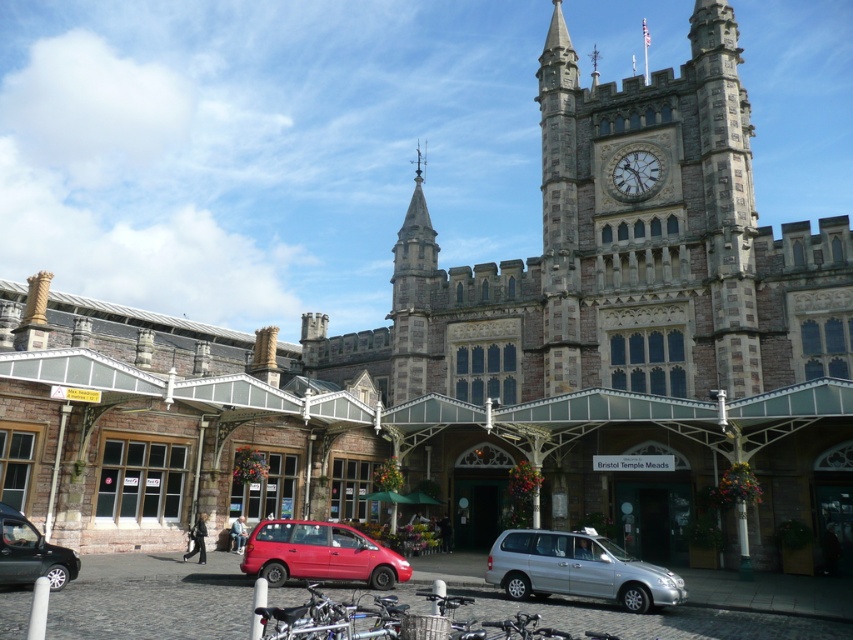
You are standing at the entrance of the grand historic building and want to park your car. The parking spot you want is located at point 0.866, 0.038. Is the matte black car at lower left blocking your way to the parking spot?

The matte black car at lower left is positioned exactly at point (32, 554), so it is blocking your way to the parking spot.

Looking at this image, you are a tourist standing in front of the historic building and want to take a photo of the stone clock at upper right without the silver metallic van at center blocking the view. Where should you position yourself relative to the van?

The silver metallic van at center is below the stone clock at upper right, so to avoid the van blocking the view, you should position yourself above the van, such as standing on a higher elevation or moving to a spot where you can look down over the van to see the clock clearly.

Based on the photo, you are a photographer planning to take a picture of the historic building. You want to include both the silver metallic van at center and the stone clock at upper right in your shot. Considering their sizes, which object should you focus on to ensure both are clearly visible in the frame?

The silver metallic van at center is larger in size than the stone clock at upper right, so focusing on the van will help ensure both are clearly visible in the frame since it occupies more space and can be positioned to include the smaller clock in the background or corner.